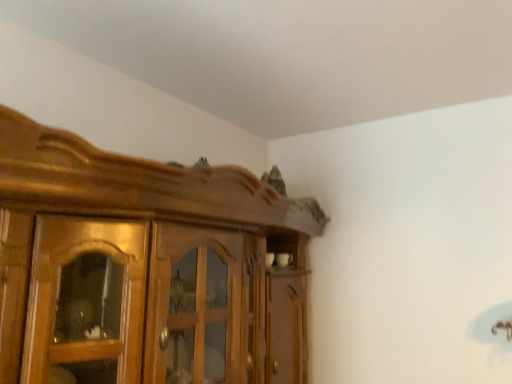
Locate an element on the screen. Image resolution: width=512 pixels, height=384 pixels. wooden cupboard at upper center is located at coordinates (145, 267).

Measure the distance between wooden cupboard at upper center and camera.

wooden cupboard at upper center is 37.04 inches away from camera.

Measure the distance between point (x=252, y=339) and camera.

A distance of 6.47 feet exists between point (x=252, y=339) and camera.

Describe the element at coordinates (145, 267) in the screenshot. I see `wooden cupboard at upper center` at that location.

In order to click on wooden cupboard at upper center in this screenshot , I will do `click(145, 267)`.